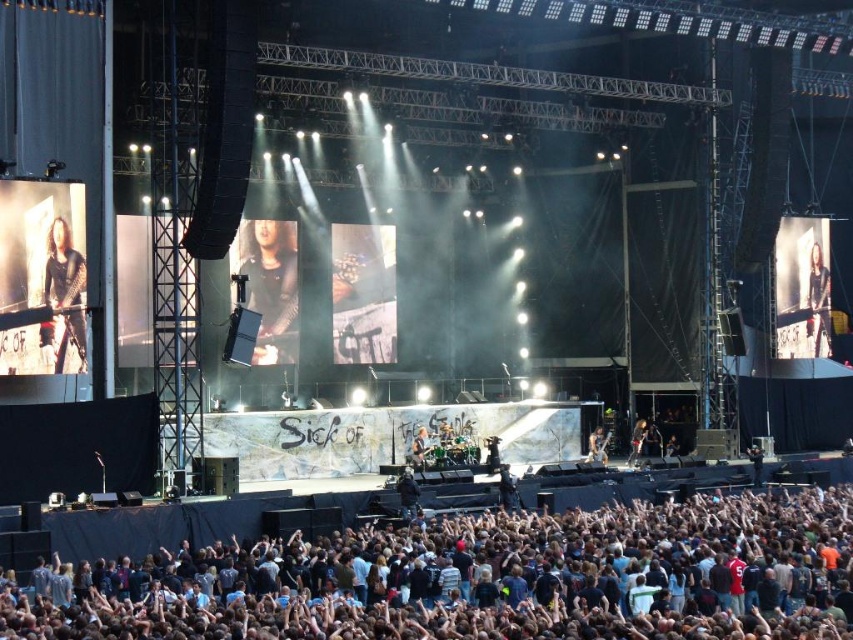
In the scene shown: Measure the distance from black leather jacket at right to metallic silver guitar at center.

The distance of black leather jacket at right from metallic silver guitar at center is 15.85 meters.

Who is positioned more to the right, black leather jacket at right or metallic silver guitar at center?

Positioned to the right is black leather jacket at right.

Between point (811, 253) and point (592, 440), which one is positioned behind?

Point (811, 253)

The height and width of the screenshot is (640, 853). Find the location of `black leather jacket at right`. black leather jacket at right is located at coordinates (817, 300).

Who is lower down, dark gray crowd at lower center or dark brown leather jacket at left?

Positioned lower is dark gray crowd at lower center.

Is dark gray crowd at lower center positioned at the back of dark brown leather jacket at left?

No, dark gray crowd at lower center is closer to the viewer.

Is point (814, 529) behind point (62, 292)?

No, it is not.

Identify the location of dark gray crowd at lower center. (479, 577).

Can you confirm if metallic silver guitar at center is positioned to the left of shiny silver guitar at center?

No, metallic silver guitar at center is not to the left of shiny silver guitar at center.

Does point (601, 449) come farther from viewer compared to point (415, 452)?

Yes, it is.

Locate an element on the screen. This screenshot has width=853, height=640. metallic silver guitar at center is located at coordinates (596, 445).